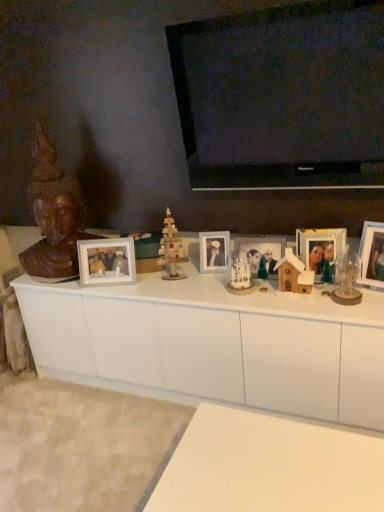
You are a GUI agent. You are given a task and a screenshot of the screen. Output one action in this format:
    pyautogui.click(x=<x>, y=<y>)
    Task: Click on the free space on the front side of matte glass photo frame at center right, which is the 2th picture frame from right to left
    
    Given the screenshot: What is the action you would take?
    pyautogui.click(x=328, y=303)